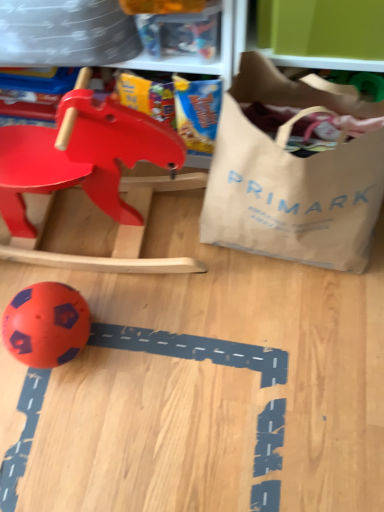
Locate an element on the screen. This screenshot has height=512, width=384. blank area beneath matte plastic rocking horse at upper left, placed as the second toy when sorted from bottom to top (from a real-world perspective) is located at coordinates click(x=104, y=226).